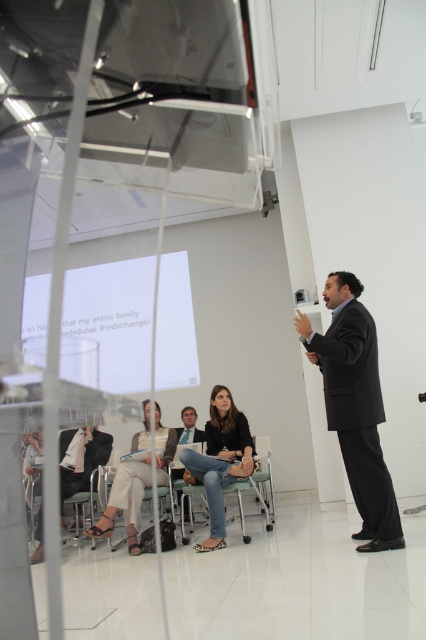
Is white paper at center behind light beige fabric pants at lower left?

That is True.

Who is shorter, white paper at center or light beige fabric pants at lower left?

With less height is light beige fabric pants at lower left.

You are a GUI agent. You are given a task and a screenshot of the screen. Output one action in this format:
    pyautogui.click(x=<x>, y=<y>)
    Task: Click on the white paper at center
    The image size is (426, 640).
    Given the screenshot: What is the action you would take?
    pyautogui.click(x=114, y=317)

This screenshot has width=426, height=640. In order to click on white paper at center in this screenshot , I will do `click(114, 317)`.

Does black suit at center have a smaller size compared to matte black jacket at center?

No, black suit at center is not smaller than matte black jacket at center.

Is point (391, 516) more distant than point (222, 438)?

No, (391, 516) is in front of (222, 438).

Does point (311, 349) come closer to viewer compared to point (213, 440)?

Yes, it is in front of point (213, 440).

What are the coordinates of `black suit at center` in the screenshot? It's located at (354, 404).

Measure the distance from matte black jacket at center to light beige fabric pants at lower left.

A distance of 25.86 inches exists between matte black jacket at center and light beige fabric pants at lower left.

Between point (226, 420) and point (115, 493), which one is positioned in front?

Point (115, 493)

In order to click on matte black jacket at center in this screenshot , I will do `click(219, 460)`.